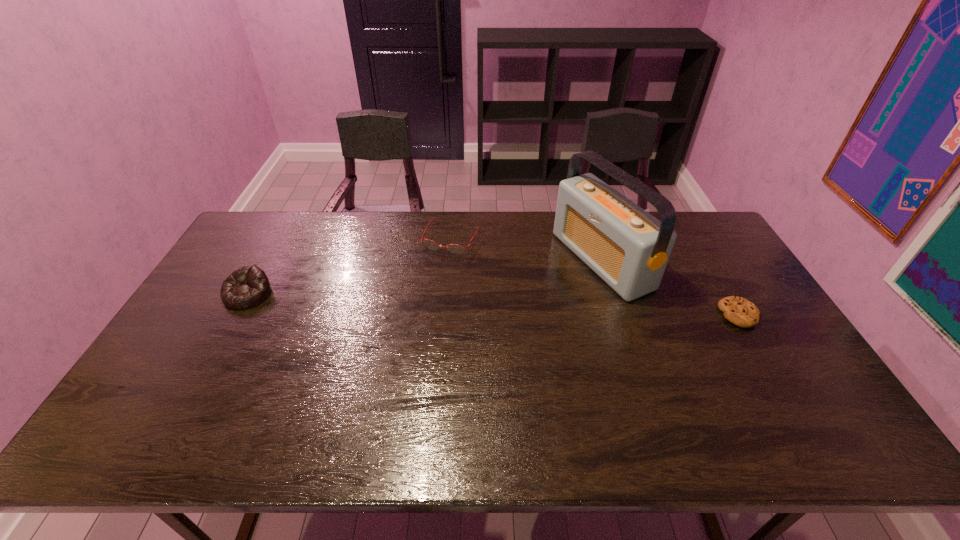
You are a GUI agent. You are given a task and a screenshot of the screen. Output one action in this format:
    pyautogui.click(x=<x>, y=<y>)
    Task: Click on the free space on the desktop that is between the third shortest object and the cookie and is positioned on the front-facing side of the radio receiver
    The image size is (960, 540).
    Given the screenshot: What is the action you would take?
    pyautogui.click(x=485, y=304)

Where is `vacant space on the desktop that is between the second tallest object and the rightmost object and is positioned on the lenses of the second object from left to right`? The height and width of the screenshot is (540, 960). vacant space on the desktop that is between the second tallest object and the rightmost object and is positioned on the lenses of the second object from left to right is located at coordinates (417, 301).